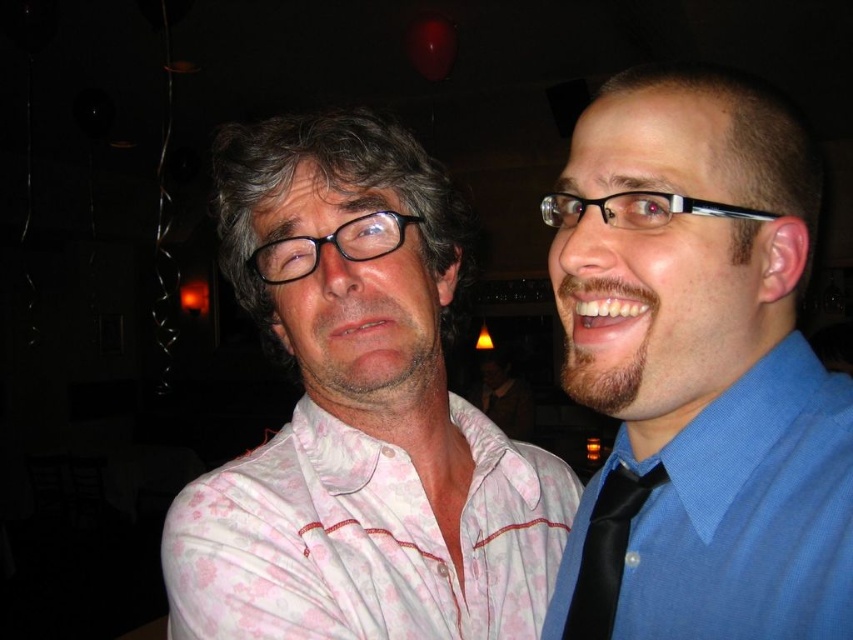
Question: Observing the image, what is the correct spatial positioning of pink floral dress shirt at center in reference to black satin tie at right?

Choices:
 (A) below
 (B) above

Answer: (A)

Question: Is blue smooth shirt at right wider than pink floral dress shirt at center?

Choices:
 (A) no
 (B) yes

Answer: (A)

Question: Estimate the real-world distances between objects in this image. Which object is farther from the white floral shirt at center?

Choices:
 (A) blue smooth shirt at right
 (B) black satin tie at right
 (C) pink floral dress shirt at center

Answer: (B)

Question: Which point appears farthest from the camera in this image?

Choices:
 (A) (283, 180)
 (B) (602, 237)
 (C) (386, 600)
 (D) (599, 538)

Answer: (A)

Question: Which point is closer to the camera?

Choices:
 (A) (764, 182)
 (B) (505, 524)
 (C) (596, 532)

Answer: (A)

Question: Where is blue smooth shirt at right located in relation to pink floral dress shirt at center in the image?

Choices:
 (A) below
 (B) above

Answer: (B)